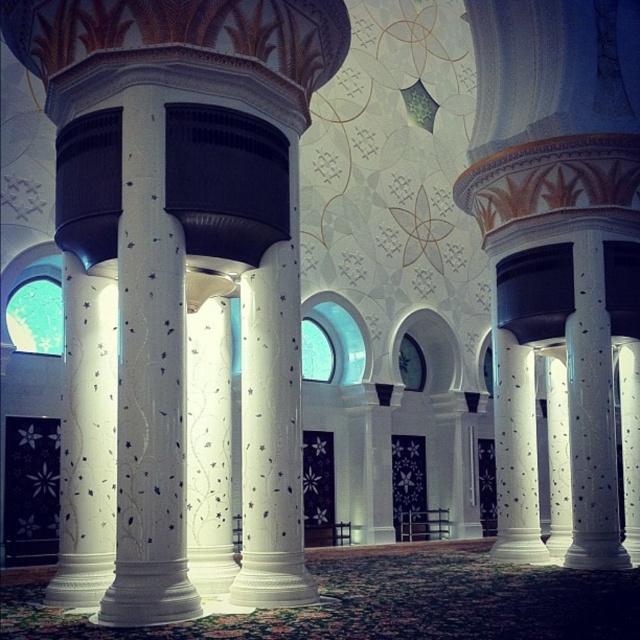
You are standing in the grand mosque interior and need to locate the white speckled marble column at right. From the white textured column at center, which direction should you move to reach it?

The white speckled marble column at right is to the right of the white textured column at center, so you should move to the right to reach it.

From the picture: You are an architect designing a new building and want to ensure proper structural support. Given the image of the mosque interior, which column, the white glossy column at center or the white speckled marble column at right, is positioned higher and thus might provide better support for the ceiling?

The white glossy column at center is above the white speckled marble column at right, so it is positioned higher and might provide better support for the ceiling.

You are an architect designing a replica of this space. You need to ensure that the white textured column at center and the white speckled marble column at right maintain their original spatial proportions. Which column should you scale down if you want to reduce the overall width of the replica while keeping their relative sizes the same?

The white speckled marble column at right should be scaled down because it occupies more space than the white textured column at center, so reducing its size would help decrease the overall width while maintaining their proportional relationship.